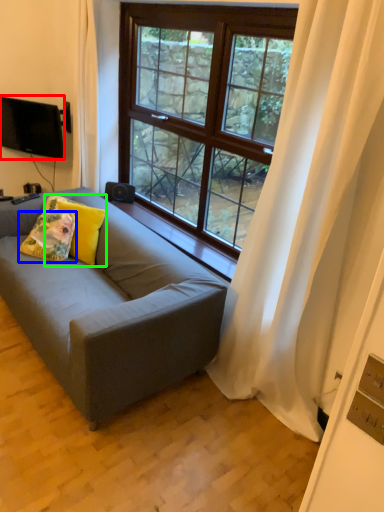
Question: Which object is the farthest from television (highlighted by a red box)? Choose among these: pillow (highlighted by a blue box) or pillow (highlighted by a green box).

Choices:
 (A) pillow
 (B) pillow

Answer: (A)